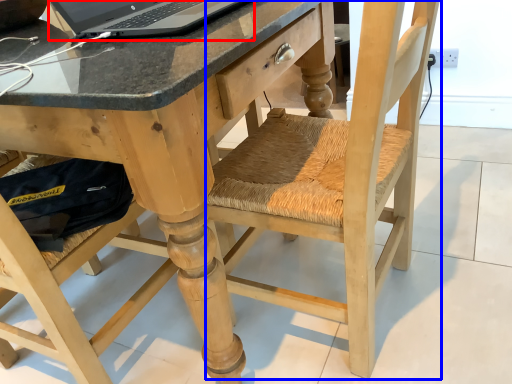
Question: Which object is closer to the camera taking this photo, laptop (highlighted by a red box) or swivel chair (highlighted by a blue box)?

Choices:
 (A) laptop
 (B) swivel chair

Answer: (B)